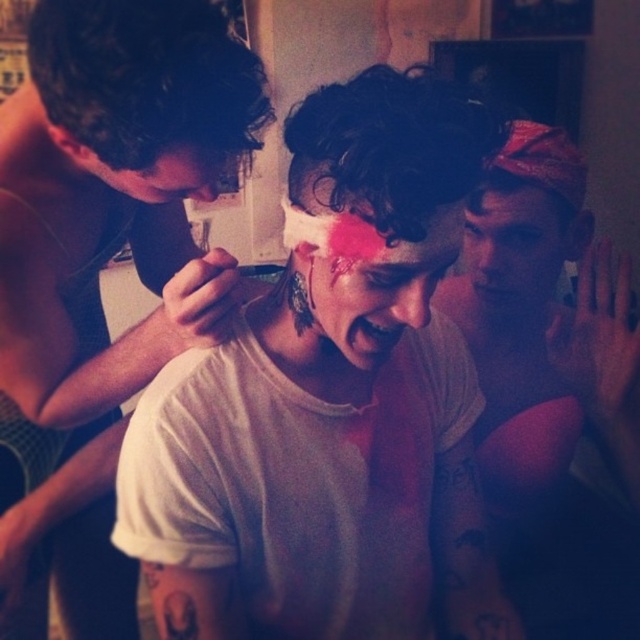
Does white matte t-shirt at center have a larger size compared to smooth skin face at upper right?

Correct, white matte t-shirt at center is larger in size than smooth skin face at upper right.

Measure the distance between point (464,381) and camera.

Point (464,381) and camera are 37.69 inches apart from each other.

Identify the location of white matte t-shirt at center. (330, 403).

Is point (176, 168) positioned before point (364, 221)?

No, (176, 168) is further to viewer.

Locate an element on the screen. Image resolution: width=640 pixels, height=640 pixels. white matte shirt at left is located at coordinates (99, 273).

Can you confirm if white matte bandana at upper right is positioned to the left of matte black face at upper left?

No, white matte bandana at upper right is not to the left of matte black face at upper left.

Which is in front, point (547, 128) or point (108, 168)?

Positioned in front is point (108, 168).

Which is behind, point (536, 314) or point (192, 172)?

Point (536, 314)

The image size is (640, 640). Find the location of `white matte bandana at upper right`. white matte bandana at upper right is located at coordinates (541, 349).